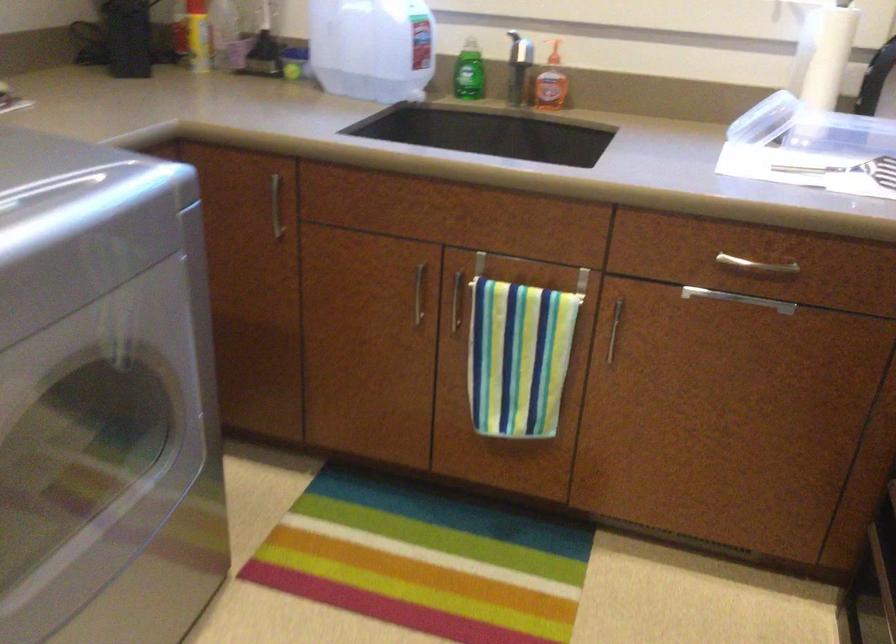
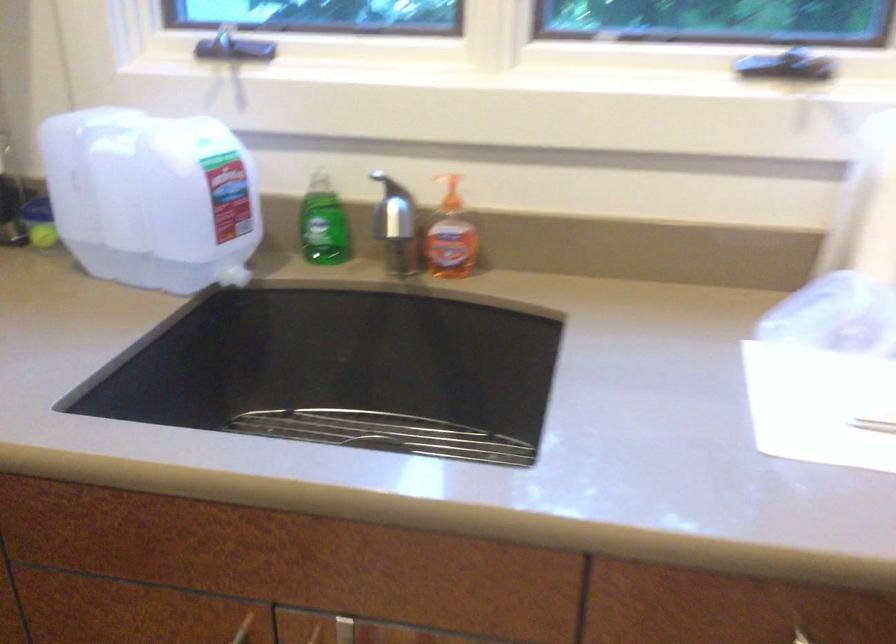
In the second image, find the point that corresponds to point (470, 71) in the first image.

(323, 223)